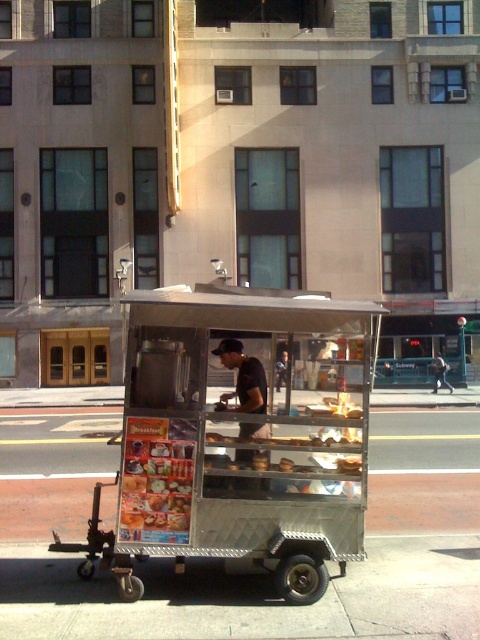
Consider the image. You are a customer standing on the brushed metal pavement at lower center wanting to approach the metallic silver cart at center to order. Which direction should you move to reach the cart?

The brushed metal pavement at lower center is positioned on the left side of metallic silver cart at center, so you should move to your right to reach the metallic silver cart at center.

You are a delivery person with a 1.5 meter wide cart. You need to park your cart near the metallic silver food cart at center without blocking the brushed metal pavement at lower center. Is there enough space between them for your cart?

The metallic silver food cart at center is 1.83 meters away from the brushed metal pavement at lower center. Since your cart is 1.5 meters wide, there is sufficient space between them to park your cart without blocking the pavement.